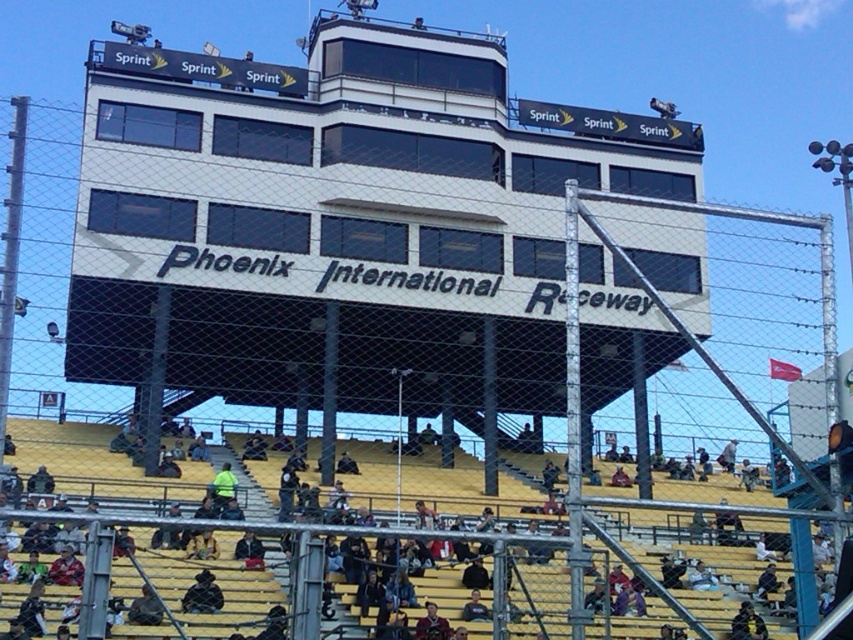
You are a spectator at Phoenix International Raceway and want to find your friend wearing a dark gray jacket at lower left. From your current position at the yellow wood bleachers at lower center, which direction should you look to spot them?

You should look downward because the yellow wood bleachers at lower center is above the dark gray jacket at lower left.

In the scene shown: You are a photographer standing at the Phoenix International Raceway grandstand. You notice two jackets in the crowd. The dark blue jacket at lower center and the dark gray jacket at lower left. Which jacket would appear taller from your vantage point?

The dark blue jacket at lower center appears taller because it has a greater height compared to the dark gray jacket at lower left.

You are a spectator standing at the base of the yellow wood bleachers at lower center and the dark blue jacket at lower center. Which object is taller?

The yellow wood bleachers at lower center is much taller than the dark blue jacket at lower center.